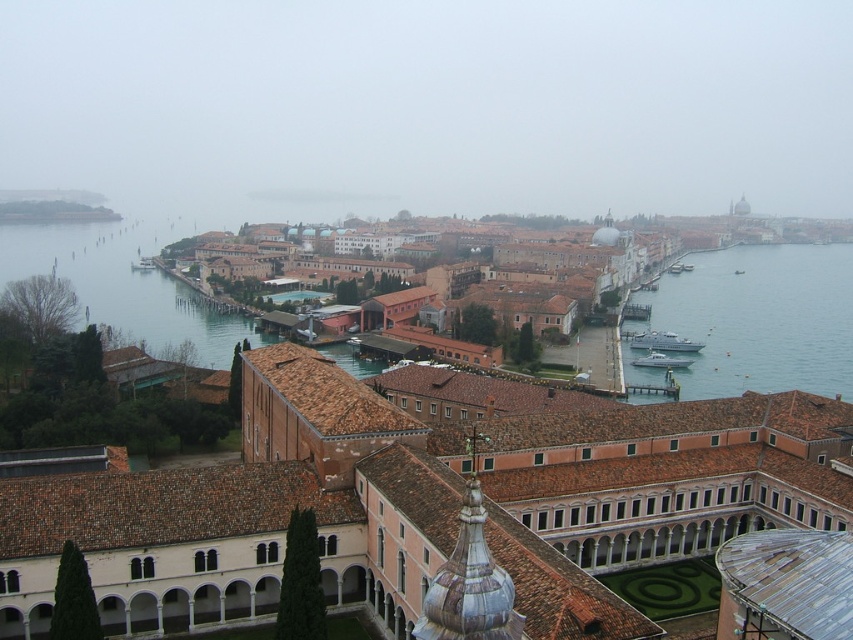
Does brown tile roof at center appear on the right side of clear blue water at right?

No, brown tile roof at center is not to the right of clear blue water at right.

Which is behind, point (564, 483) or point (726, 390)?

Positioned behind is point (726, 390).

Is point (173, 552) positioned in front of point (734, 294)?

Yes, point (173, 552) is in front of point (734, 294).

Locate an element on the screen. brown tile roof at center is located at coordinates (248, 513).

Between brown tile roof at center and brown brick buildings at center, which one has more height?

brown brick buildings at center is taller.

Is brown tile roof at center to the right of brown brick buildings at center from the viewer's perspective?

Yes, brown tile roof at center is to the right of brown brick buildings at center.

Who is more forward, (786, 422) or (547, 291)?

Point (786, 422)

The width and height of the screenshot is (853, 640). Identify the location of brown tile roof at center. (248, 513).

Who is lower down, clear blue water at lower left or silver metallic boat at center-right?

Positioned lower is silver metallic boat at center-right.

Which is in front, point (112, 241) or point (679, 342)?

Point (679, 342)

In the scene shown: Who is more forward, (155, 284) or (653, 332)?

Point (653, 332) is in front.

Locate an element on the screen. clear blue water at lower left is located at coordinates (125, 285).